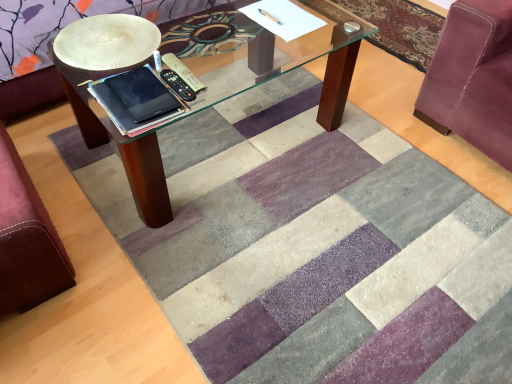
Where is `vacant area that is situated to the right of velvet burgundy swivel chair at lower left, which is counted as the second swivel chair, starting from the right`? The image size is (512, 384). vacant area that is situated to the right of velvet burgundy swivel chair at lower left, which is counted as the second swivel chair, starting from the right is located at coordinates (139, 239).